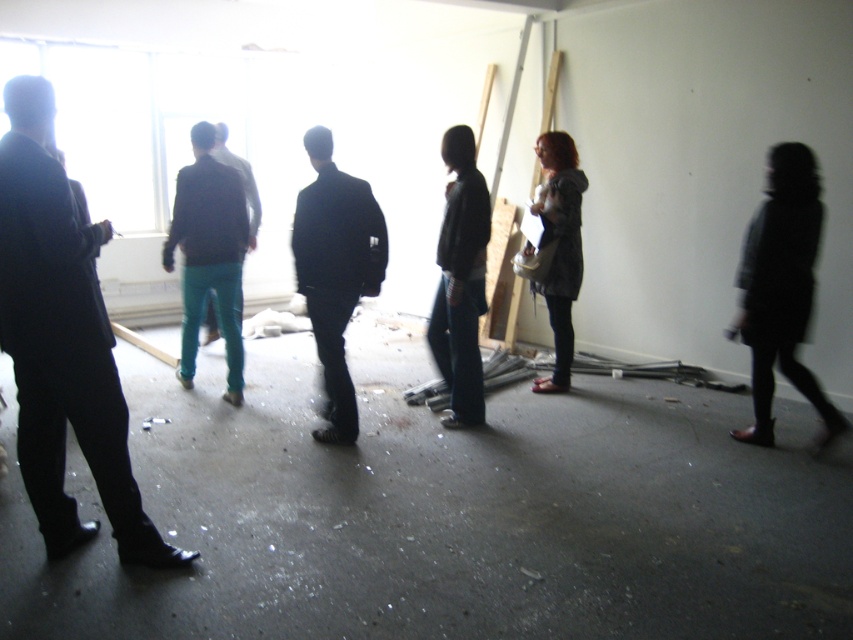
Question: Which is farther from the matte black suit at left?

Choices:
 (A) matte gray jacket at center
 (B) dark gray fabric dress at right
 (C) teal fabric pants at center
 (D) black matte suit at center

Answer: (B)

Question: Does teal fabric pants at center have a greater width compared to dark gray jacket at center?

Choices:
 (A) no
 (B) yes

Answer: (B)

Question: Does matte black suit at left appear on the left side of black matte suit at center?

Choices:
 (A) yes
 (B) no

Answer: (A)

Question: Which object appears farthest from the camera in this image?

Choices:
 (A) teal fabric pants at center
 (B) teal pants at center
 (C) dark gray fabric dress at right

Answer: (B)

Question: Which point appears farthest from the camera in this image?

Choices:
 (A) (547, 189)
 (B) (808, 269)

Answer: (A)

Question: Can you confirm if dark gray fabric dress at right is positioned above teal pants at center?

Choices:
 (A) yes
 (B) no

Answer: (B)